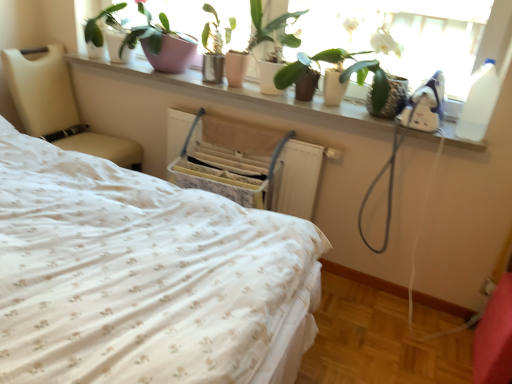
Question: Is beige leather chair at left aimed at pink ceramic pot at upper center, acting as the second houseplant starting from the right?

Choices:
 (A) no
 (B) yes

Answer: (A)

Question: Is the surface of beige leather chair at left in direct contact with pink ceramic pot at upper center, which is counted as the first houseplant, starting from the left?

Choices:
 (A) yes
 (B) no

Answer: (B)

Question: From a real-world perspective, does beige leather chair at left sit lower than pink ceramic pot at upper center, which is counted as the first houseplant, starting from the left?

Choices:
 (A) no
 (B) yes

Answer: (B)

Question: Does beige leather chair at left appear on the right side of pink ceramic pot at upper center, which is counted as the first houseplant, starting from the left?

Choices:
 (A) no
 (B) yes

Answer: (A)

Question: Is beige leather chair at left smaller than pink ceramic pot at upper center, acting as the second houseplant starting from the right?

Choices:
 (A) no
 (B) yes

Answer: (A)

Question: Is white ceramic plants at upper center taller or shorter than matte white pot at upper center?

Choices:
 (A) short
 (B) tall

Answer: (A)

Question: Based on their sizes in the image, would you say white ceramic plants at upper center is bigger or smaller than matte white pot at upper center?

Choices:
 (A) big
 (B) small

Answer: (B)

Question: Is white ceramic plants at upper center wider or thinner than matte white pot at upper center?

Choices:
 (A) thin
 (B) wide

Answer: (B)

Question: Do you think white ceramic plants at upper center is within matte white pot at upper center, or outside of it?

Choices:
 (A) inside
 (B) outside

Answer: (B)

Question: Relative to white floral fabric bed at center, is green matte plant at upper center, acting as the second houseplant starting from the left, in front or behind?

Choices:
 (A) front
 (B) behind

Answer: (B)

Question: In terms of width, does green matte plant at upper center, acting as the second houseplant starting from the left, look wider or thinner when compared to white floral fabric bed at center?

Choices:
 (A) thin
 (B) wide

Answer: (A)

Question: In terms of size, does green matte plant at upper center, arranged as the 1th houseplant when viewed from the right, appear bigger or smaller than white floral fabric bed at center?

Choices:
 (A) big
 (B) small

Answer: (B)

Question: Is green matte plant at upper center, acting as the second houseplant starting from the left, situated inside white floral fabric bed at center or outside?

Choices:
 (A) inside
 (B) outside

Answer: (B)

Question: Is point (259, 130) positioned closer to the camera than point (260, 38)?

Choices:
 (A) farther
 (B) closer

Answer: (A)

Question: Choose the correct answer: Is wooden swivel chair at center inside green matte plant at upper center, acting as the second houseplant starting from the left, or outside it?

Choices:
 (A) inside
 (B) outside

Answer: (B)